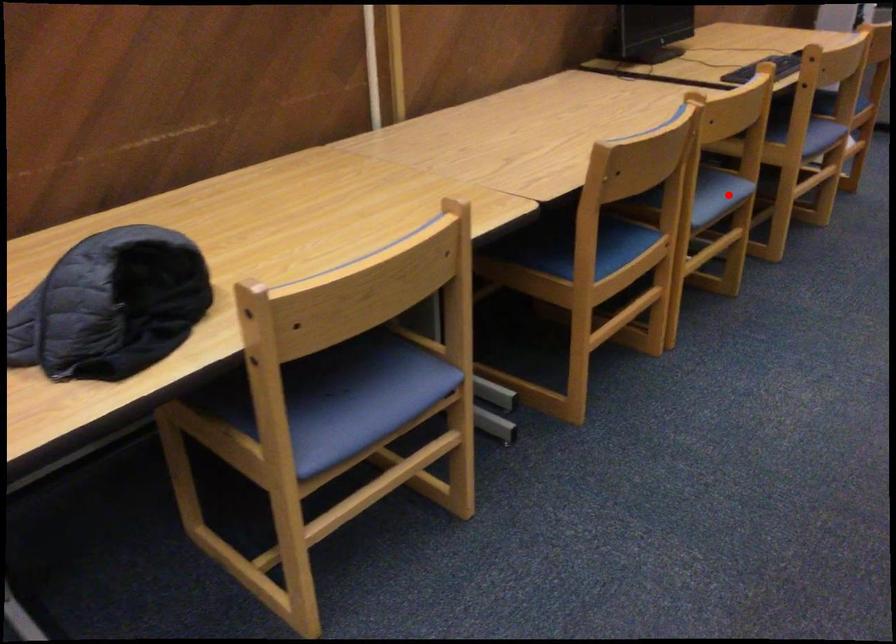
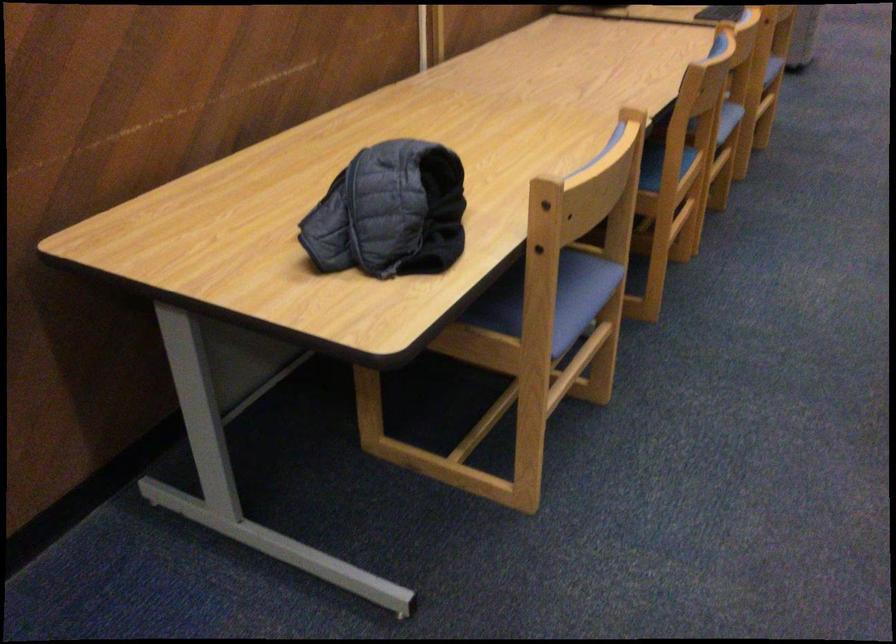
The point at the highlighted location is marked in the first image. Where is the corresponding point in the second image?

(728, 118)